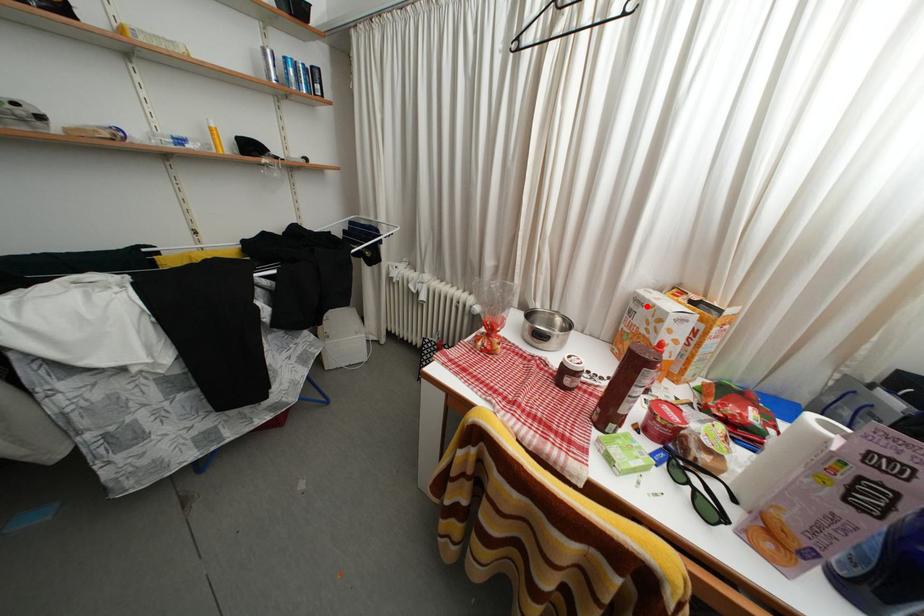
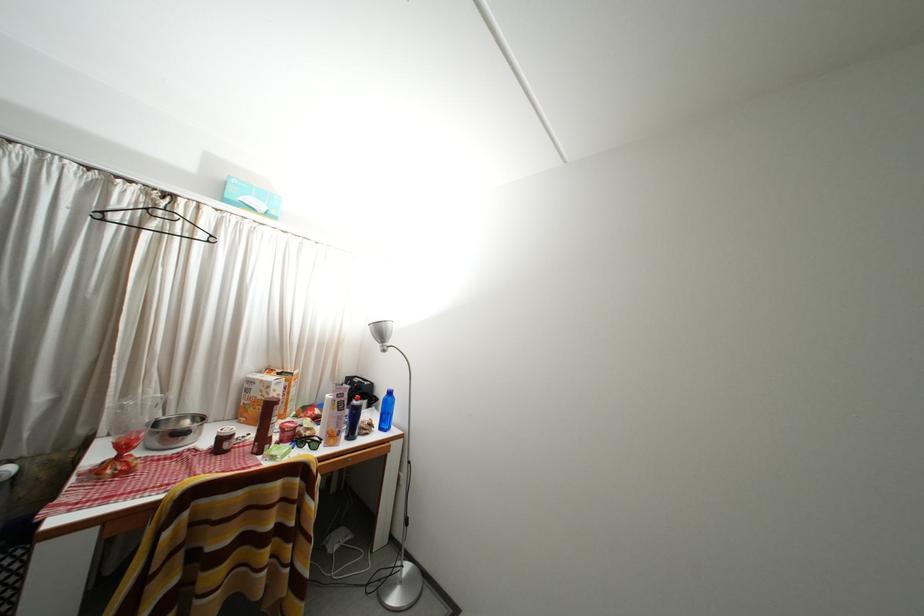
Question: I am providing you with two images of the same scene from different viewpoints. A red point is marked on the first image. Is the red point's position out of view in image 2?

Choices:
 (A) Yes
 (B) No

Answer: (B)